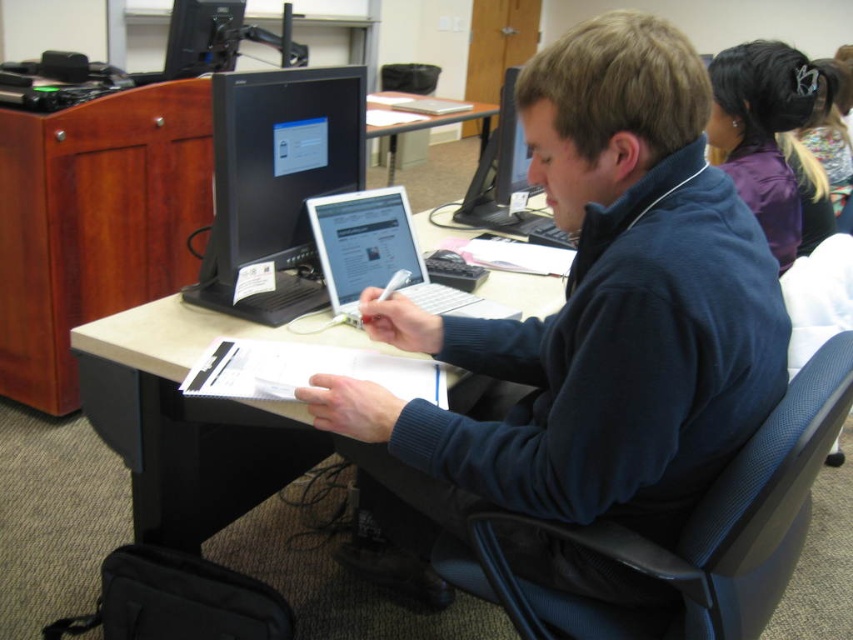
Is blue fleece jacket at center smaller than black glossy monitor at center?

Actually, blue fleece jacket at center might be larger than black glossy monitor at center.

Measure the distance between blue fleece jacket at center and camera.

80.64 centimeters

Locate an element on the screen. The height and width of the screenshot is (640, 853). blue fleece jacket at center is located at coordinates (585, 324).

Can you confirm if beige wood table at center is bigger than light brown wooden table at center?

Incorrect, beige wood table at center is not larger than light brown wooden table at center.

Can you confirm if beige wood table at center is positioned to the left of light brown wooden table at center?

Indeed, beige wood table at center is positioned on the left side of light brown wooden table at center.

This screenshot has width=853, height=640. Identify the location of beige wood table at center. (189, 419).

Between blue fleece jacket at center and purple fabric hair tie at upper right, which one appears on the left side from the viewer's perspective?

blue fleece jacket at center

Between point (560, 52) and point (809, 211), which one is positioned in front?

Point (560, 52) is in front.

Does point (712, 221) come closer to viewer compared to point (734, 147)?

Yes, it is.

At what (x,y) coordinates should I click in order to perform the action: click on blue fleece jacket at center. Please return your answer as a coordinate pair (x, y). Image resolution: width=853 pixels, height=640 pixels. Looking at the image, I should click on (585, 324).